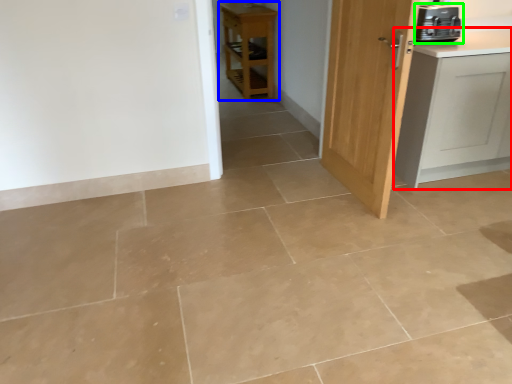
Question: Which is farther away from cabinetry (highlighted by a red box)? furniture (highlighted by a blue box) or home appliance (highlighted by a green box)?

Choices:
 (A) furniture
 (B) home appliance

Answer: (A)